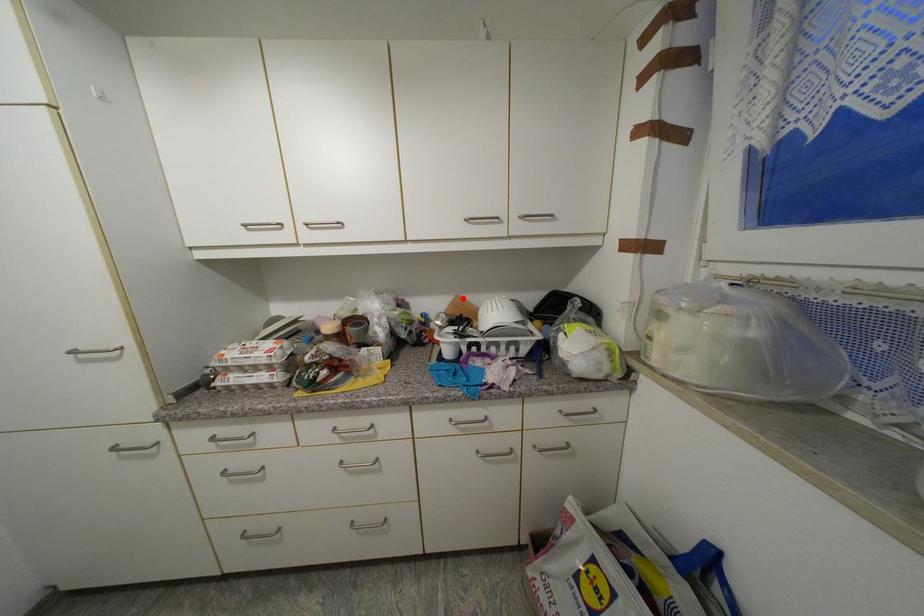
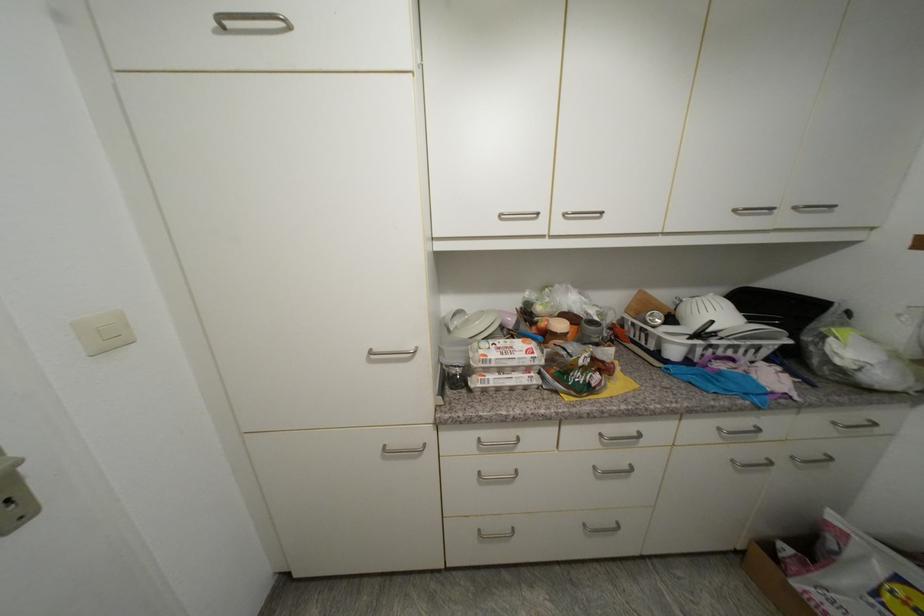
Where in the second image is the point corresponding to the highlighted location from the first image?

(647, 294)